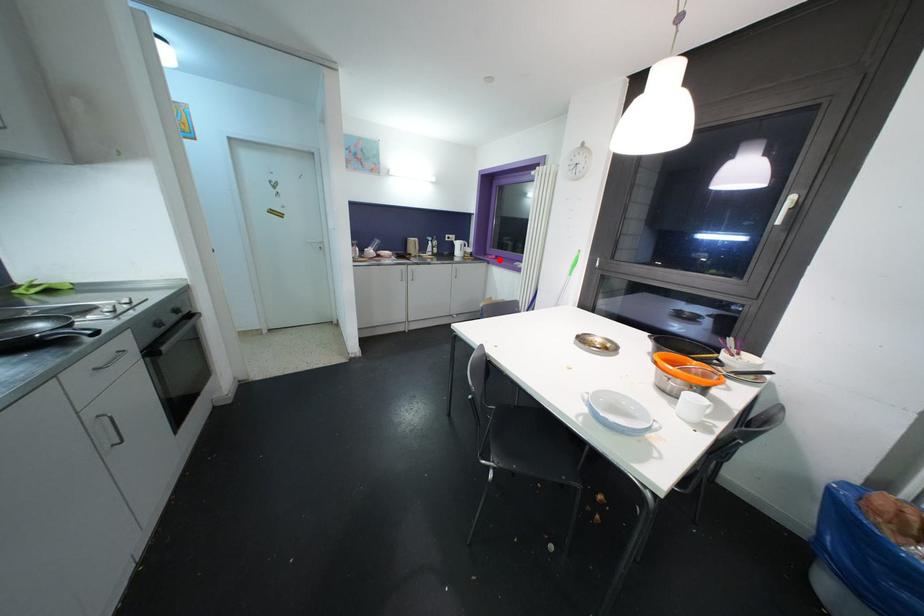
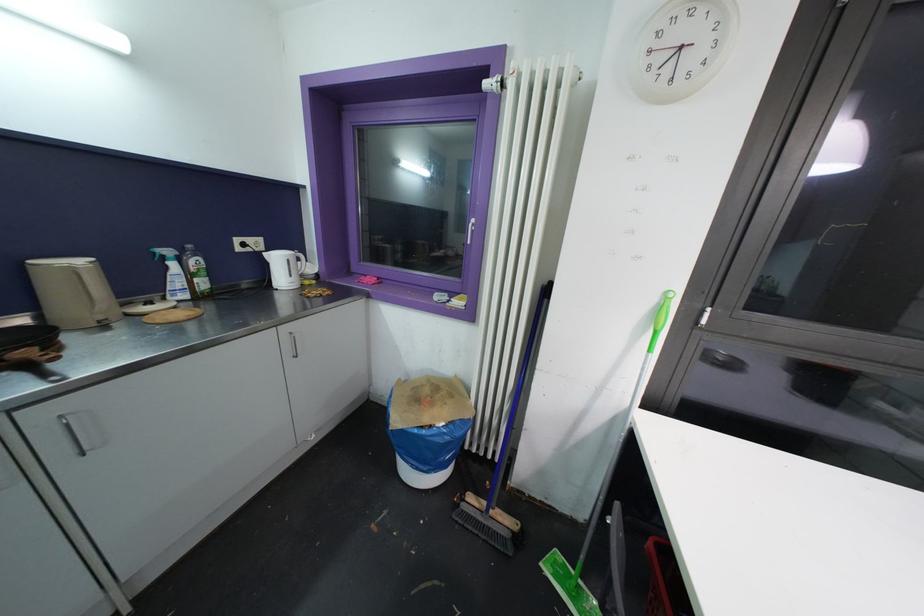
Question: I am providing you with two images of the same scene from different viewpoints. In image1, a red point is highlighted. Considering the same 3D point in image2, which of the following is correct?

Choices:
 (A) It is closer
 (B) It is farther

Answer: (B)